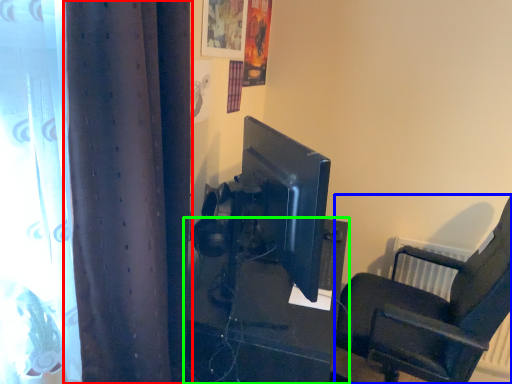
Question: Estimate the real-world distances between objects in this image. Which object is farther from curtain (highlighted by a red box), chair (highlighted by a blue box) or furniture (highlighted by a green box)?

Choices:
 (A) chair
 (B) furniture

Answer: (A)